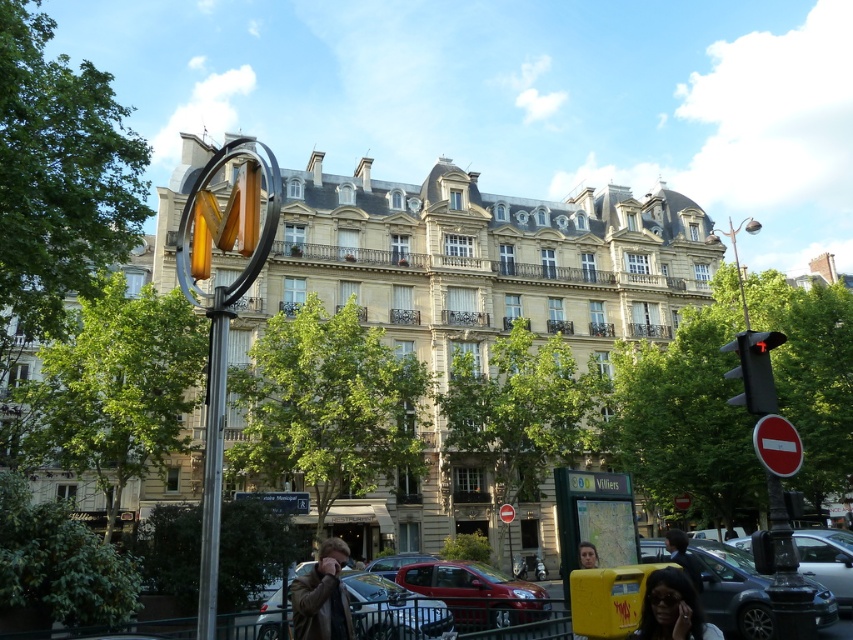
I want to click on shiny red car at center, so click(476, 593).

Is shiny red car at center shorter than metallic red car at center?

Indeed, shiny red car at center has a lesser height compared to metallic red car at center.

You are a GUI agent. You are given a task and a screenshot of the screen. Output one action in this format:
    pyautogui.click(x=<x>, y=<y>)
    Task: Click on the shiny red car at center
    The width and height of the screenshot is (853, 640).
    Given the screenshot: What is the action you would take?
    click(x=476, y=593)

The height and width of the screenshot is (640, 853). I want to click on shiny red car at center, so click(x=476, y=593).

What do you see at coordinates (322, 596) in the screenshot? This screenshot has height=640, width=853. I see `brown leather jacket at lower center` at bounding box center [322, 596].

Can you confirm if brown leather jacket at lower center is shorter than dark brown leather jacket at lower center?

Correct, brown leather jacket at lower center is not as tall as dark brown leather jacket at lower center.

Does point (306, 595) come farther from viewer compared to point (683, 540)?

No, (306, 595) is closer to viewer.

Locate an element on the screen. The image size is (853, 640). brown leather jacket at lower center is located at coordinates (322, 596).

Who is positioned more to the right, matte red car at center or smooth brown hair at center?

From the viewer's perspective, smooth brown hair at center appears more on the right side.

Between matte red car at center and smooth brown hair at center, which one appears on the left side from the viewer's perspective?

matte red car at center

Locate an element on the screen. matte red car at center is located at coordinates (395, 563).